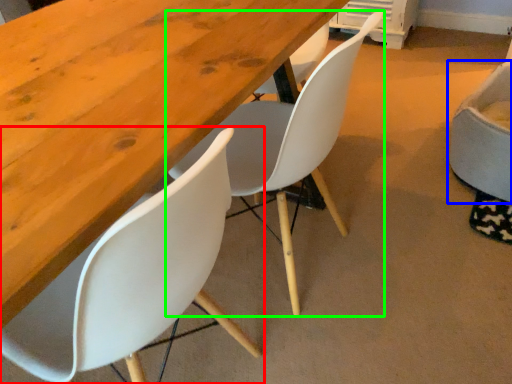
Question: Estimate the real-world distances between objects in this image. Which object is closer to chair (highlighted by a red box), chair (highlighted by a blue box) or chair (highlighted by a green box)?

Choices:
 (A) chair
 (B) chair

Answer: (B)